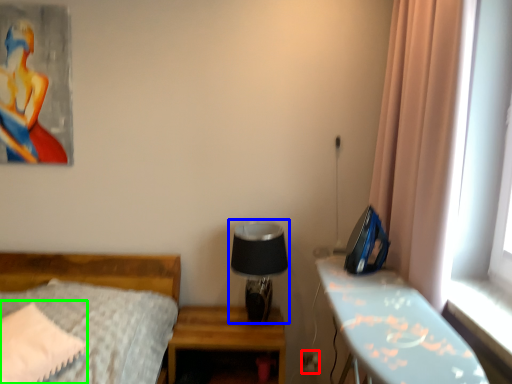
Question: Which object is the farthest from electric outlet (highlighted by a red box)? Choose among these: table lamp (highlighted by a blue box) or pillow (highlighted by a green box).

Choices:
 (A) table lamp
 (B) pillow

Answer: (B)